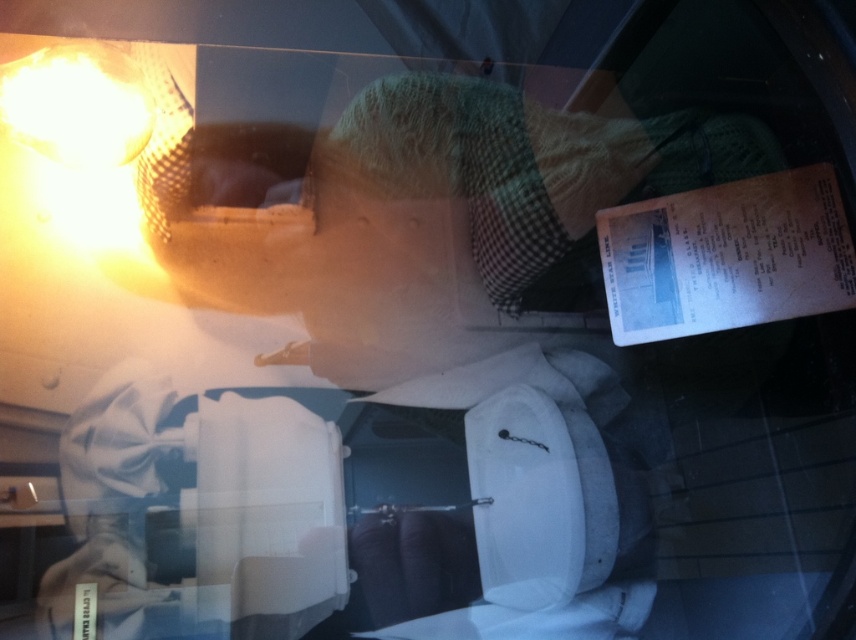
You are standing in a restroom and see the green knitted hat at upper center and the matte yellow mesh lamp at upper left. Which object is positioned more to the right side?

The green knitted hat at upper center is positioned more to the right side than the matte yellow mesh lamp at upper left.

You are a photographer trying to capture a clear shot of the green knitted hat at upper center. Considering the reflective surface and the distance between the hat and the camera, can you estimate if the reflection might interfere with the clarity of the photo?

The green knitted hat at upper center is 38.71 inches away from the camera. However, the reflective surface in the scene may cause distortion and reflections that could interfere with the clarity of the photo, making it difficult to capture a clear image.

You are a designer trying to decide whether to place a new shelf between the green knitted hat at upper center and the matte yellow mesh lamp at upper left. Based on their heights, which object should the shelf be placed closer to in order to accommodate both?

The green knitted hat at upper center is much taller than the matte yellow mesh lamp at upper left, so the shelf should be placed closer to the green knitted hat at upper center to accommodate its height.